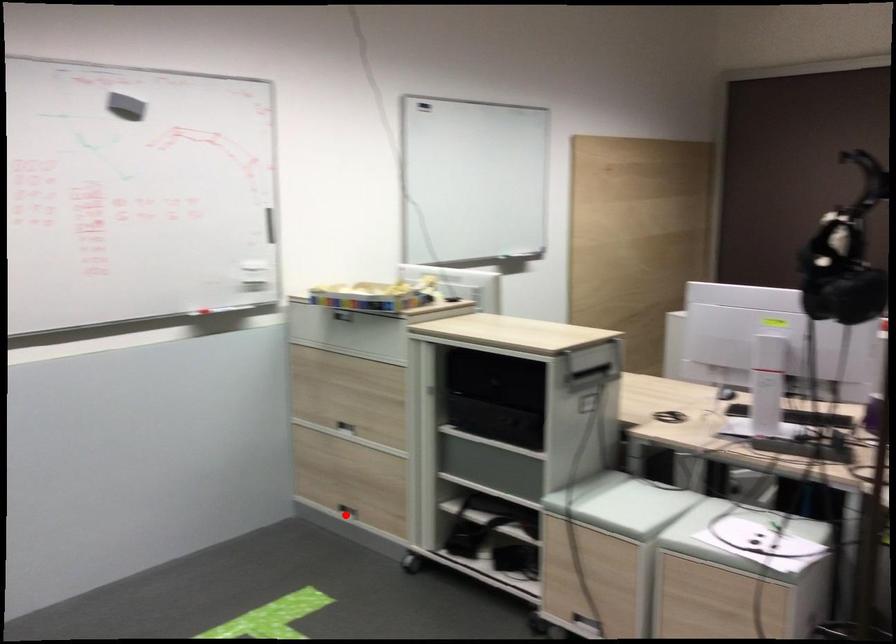
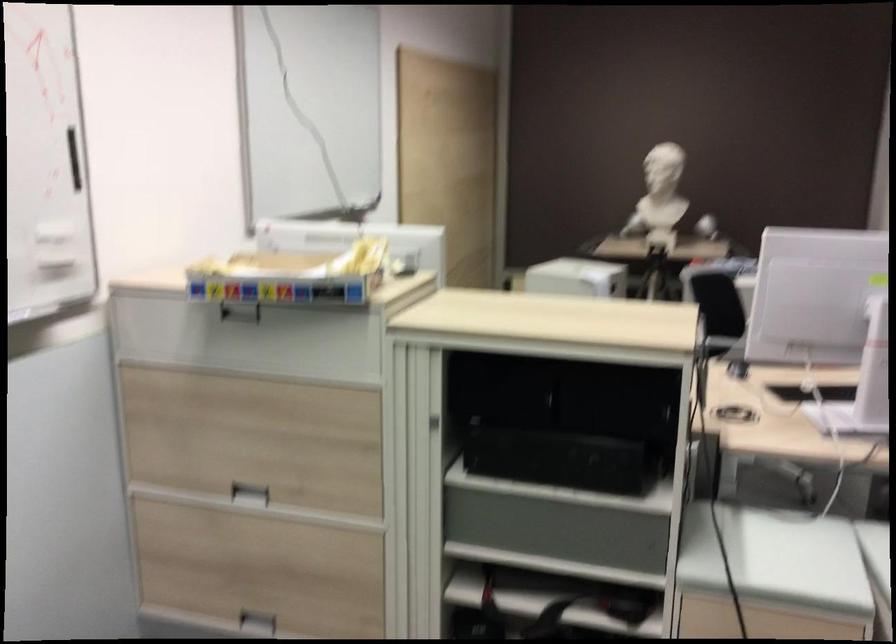
Question: I am providing you with two images of the same scene from different viewpoints. Given a red point in image1, look at the same physical point in image2. Is it:

Choices:
 (A) Closer to the viewpoint
 (B) Farther from the viewpoint

Answer: (A)